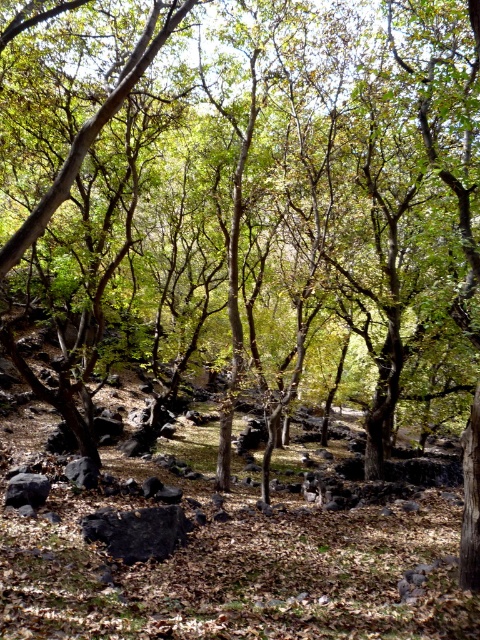
Looking at this image, you are hiking in the forest and notice two rocks at your feet. You see the dark gray rock at lower left and the black smooth rock at lower left. Which rock is closer to you?

The dark gray rock at lower left is closer to the viewer than the black smooth rock at lower left.

You are a hiker navigating through the forest and want to place a marker at point (180, 528) and another at point (92, 484). Which marker will appear higher in your field of view?

Point (180, 528) is closer to the camera than point (92, 484), so the marker at point (180, 528) will appear higher in your field of view.

You are navigating through the forest depicted in the scene. You have to move from your current position to a destination point. There are two reference points marked as point 1 at coordinates (141,556) and point 2 at coordinates (35,493). According to the spatial arrangement, which point is closer to your current position if you are facing the direction where point 2 is located?

Point 2 at coordinates (35,493) is closer to your current position because it is behind point 1 at coordinates (141,556) when facing the direction of point 2.